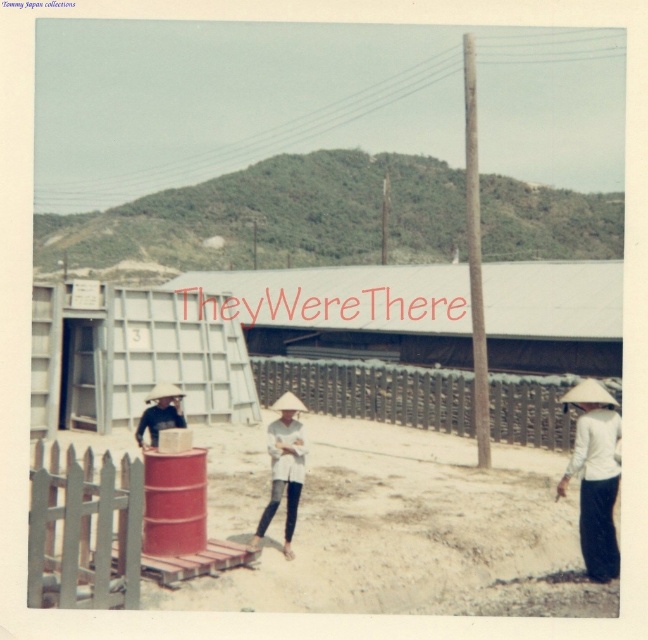
From the picture: You are standing in the scene and want to place a small flag exactly between the brown sandy ground at center and the white matte hat at center. According to the scene description, which object should the flag be closer to?

The brown sandy ground at center is to the right of the white matte hat at center, so the flag should be closer to the white matte hat at center.

You are a photographer trying to capture a detailed shot of the brown sandy ground at center and the white matte conical hat at lower right. Which object should you focus on first if you want to ensure both are in focus without adjusting your camera settings?

The brown sandy ground at center is closer to the viewer than the white matte conical hat at lower right. To keep both in focus, you should focus on the brown sandy ground at center first, as it is closer, and the depth of field will extend to the farther object.

You are standing at the point labeled as point (413, 532) in the image. What is the color of the ground beneath your feet?

The point (413, 532) corresponds to brown sandy ground at center, so the ground beneath your feet is brown sandy.